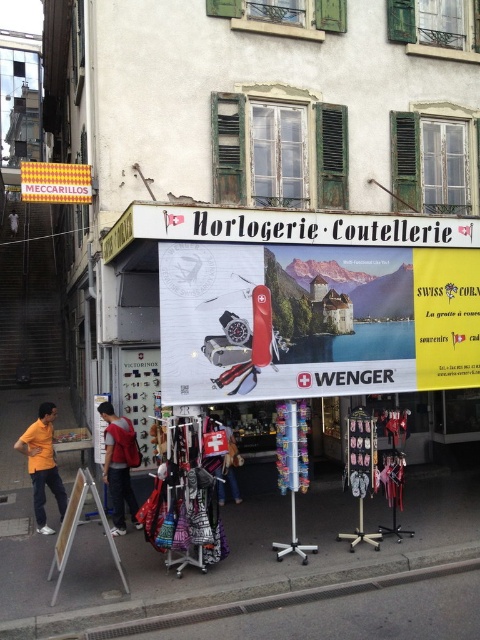
You are standing at the entrance of the Horlogerie Coutellerie store in Switzerland. You need to place a small flower pot on the gray concrete curb at lower center. What are the coordinates where you should place it?

The gray concrete curb at lower center is located at coordinates point (242,596), so you should place the flower pot there.

You are a delivery person with a cart that is 5 meters wide. You need to deliver packages to the gray concrete curb at lower center. Is there enough space between the two objects to maneuver your cart?

The two objects are 5.18 meters apart, so yes, the cart can fit since it is 5 meters wide and the space is slightly wider than the cart.